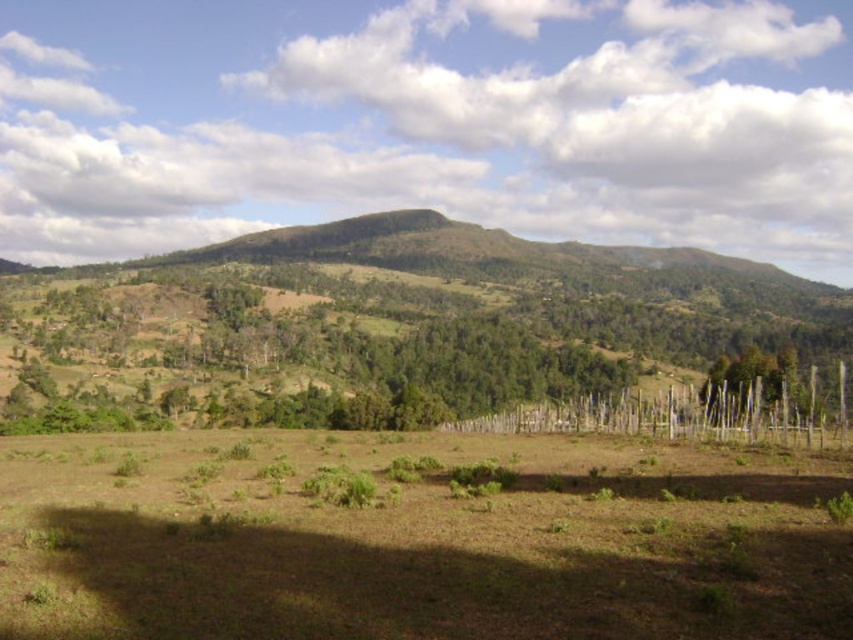
Question: Can you confirm if brown grassy field at center is positioned to the left of green leafy trees at left?

Choices:
 (A) no
 (B) yes

Answer: (B)

Question: Is brown grassy field at center further to camera compared to green wood fence at right?

Choices:
 (A) no
 (B) yes

Answer: (A)

Question: Which of the following is the closest to the observer?

Choices:
 (A) green leafy trees at left
 (B) green wood fence at right

Answer: (A)

Question: Estimate the real-world distances between objects in this image. Which object is closer to the green wood fence at right?

Choices:
 (A) green leafy trees at left
 (B) brown grassy field at center

Answer: (B)

Question: Is green leafy trees at left positioned in front of green wood fence at right?

Choices:
 (A) yes
 (B) no

Answer: (A)

Question: Among these objects, which one is nearest to the camera?

Choices:
 (A) green wood fence at right
 (B) brown grassy field at center
 (C) green leafy trees at left

Answer: (B)